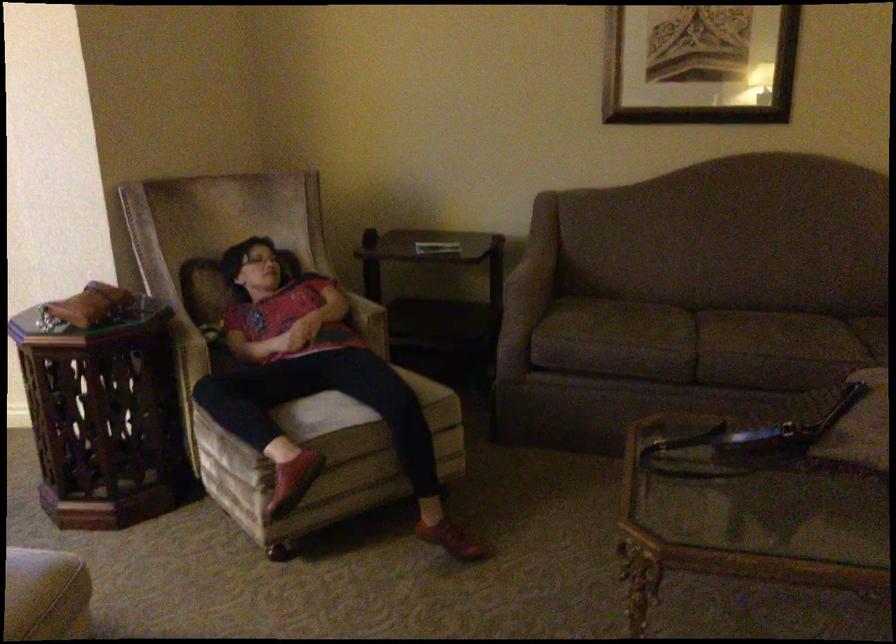
Find where to sit the chair sitting surface. Please return your answer as a coordinate pair (x, y).

(321, 415)